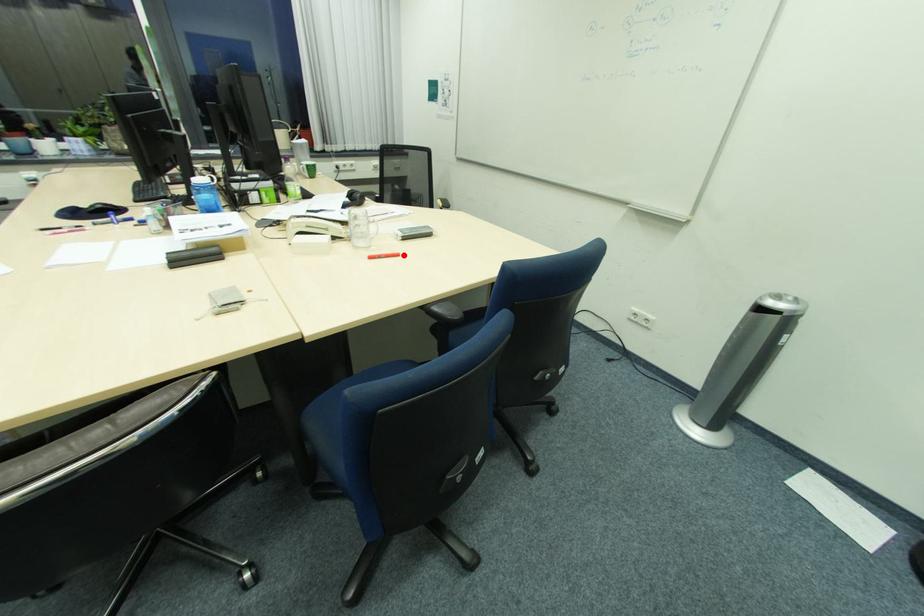
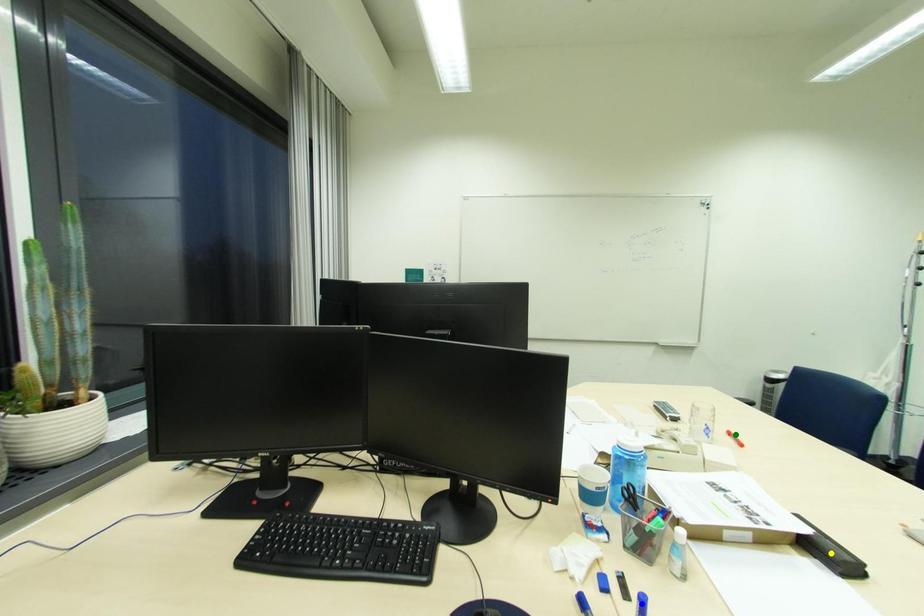
Question: I am providing you with two images of the same scene from different viewpoints. A red point is marked on the first image. You are given multiple points on the second image. Can you choose the point in image 2 that corresponds to the point in image 1?

Choices:
 (A) green point
 (B) blue point
 (C) yellow point

Answer: (A)